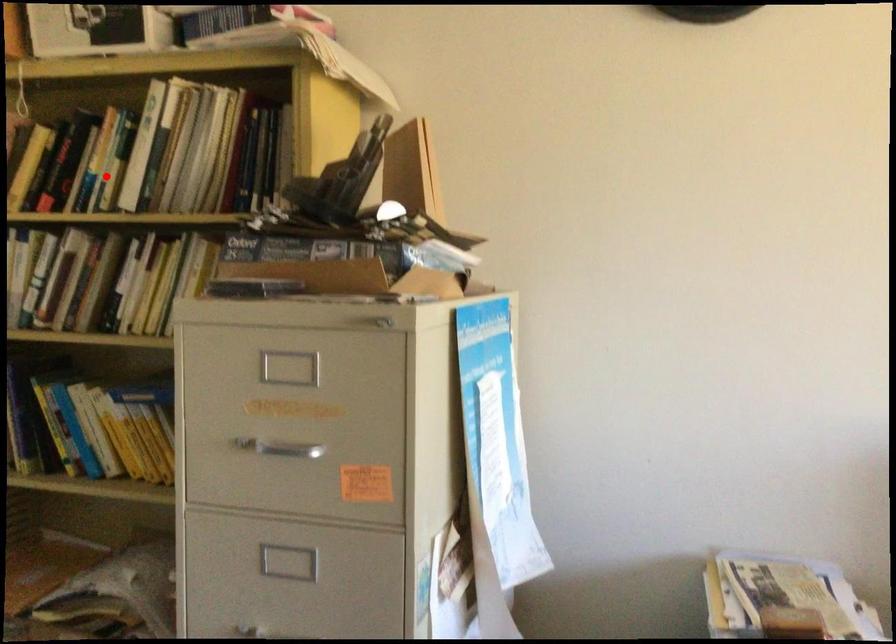
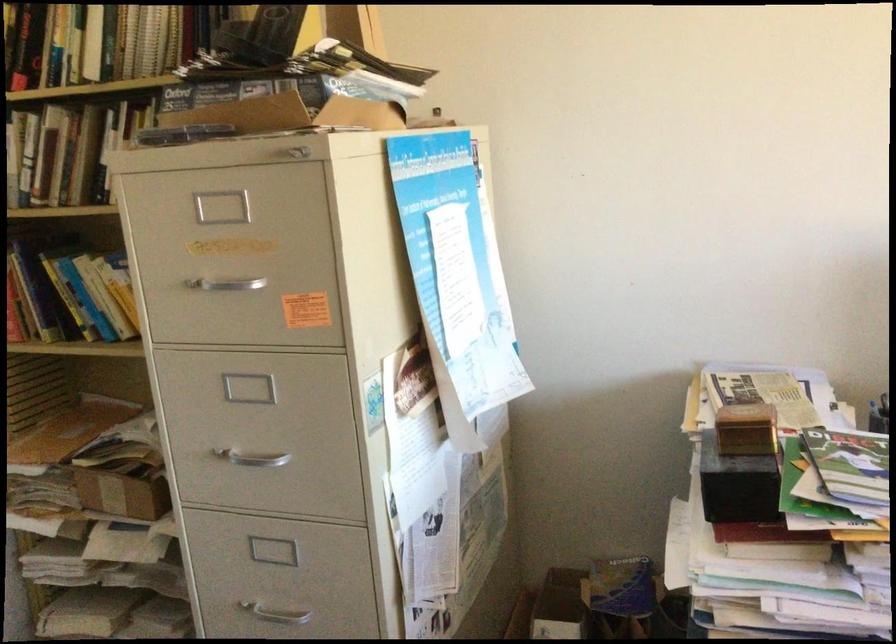
Where in the second image is the point corresponding to the highlighted location from the first image?

(62, 46)